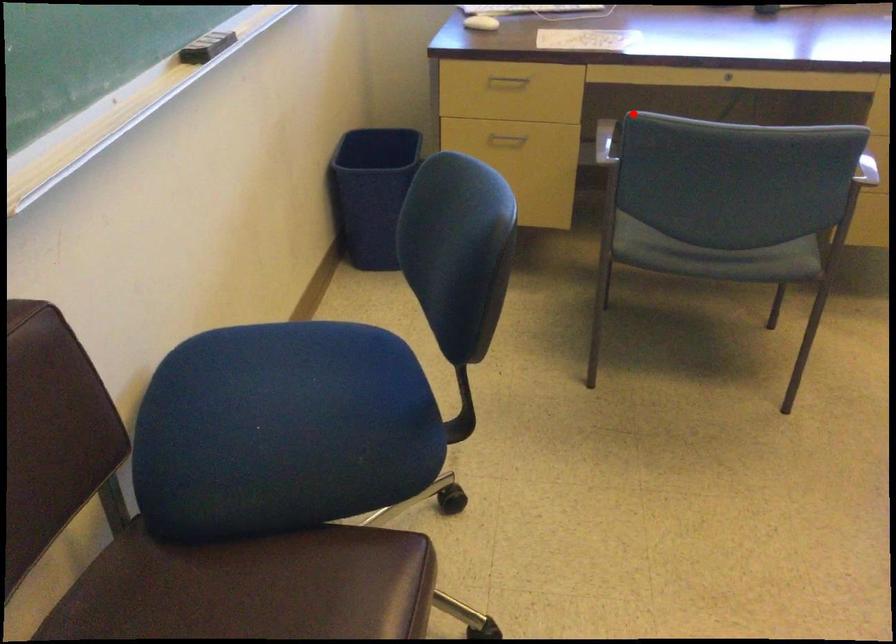
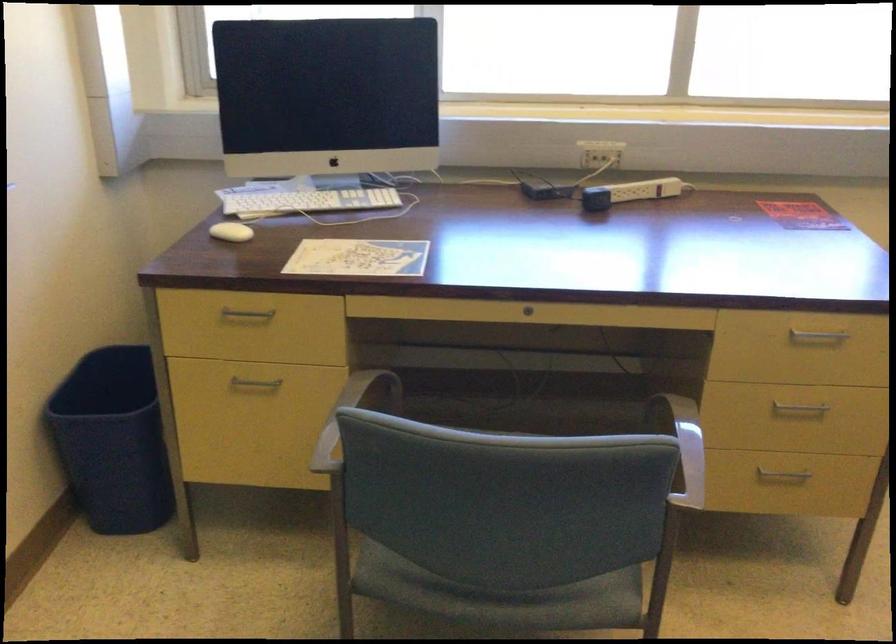
Question: I am providing you with two images of the same scene from different viewpoints. In image1, a red point is highlighted. Considering the same 3D point in image2, which of the following is correct?

Choices:
 (A) It is closer
 (B) It is farther

Answer: (A)